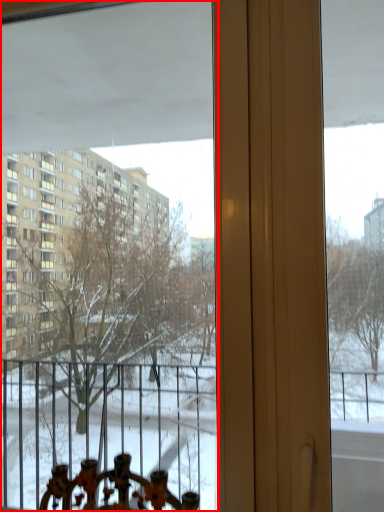
Question: Where is window (annotated by the red box) located in relation to window screen in the image?

Choices:
 (A) right
 (B) left

Answer: (B)